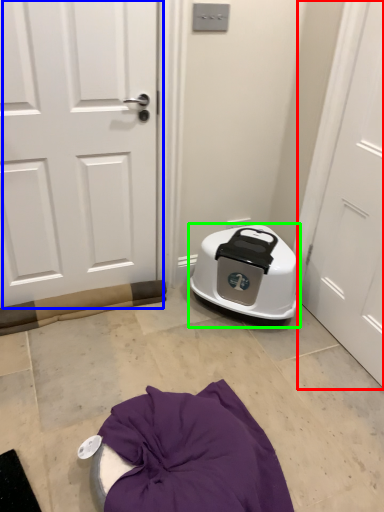
Question: Considering the real-world distances, which object is closest to door (highlighted by a red box)? door (highlighted by a blue box) or appliance (highlighted by a green box).

Choices:
 (A) door
 (B) appliance

Answer: (B)